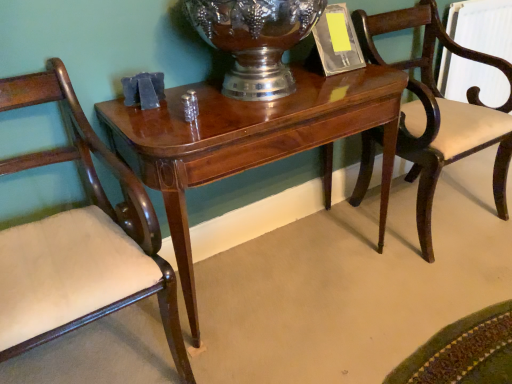
The height and width of the screenshot is (384, 512). Find the location of `vacant space in front of mahogany wood chair at right, placed as the 2th chair when sorted from left to right`. vacant space in front of mahogany wood chair at right, placed as the 2th chair when sorted from left to right is located at coordinates tap(431, 289).